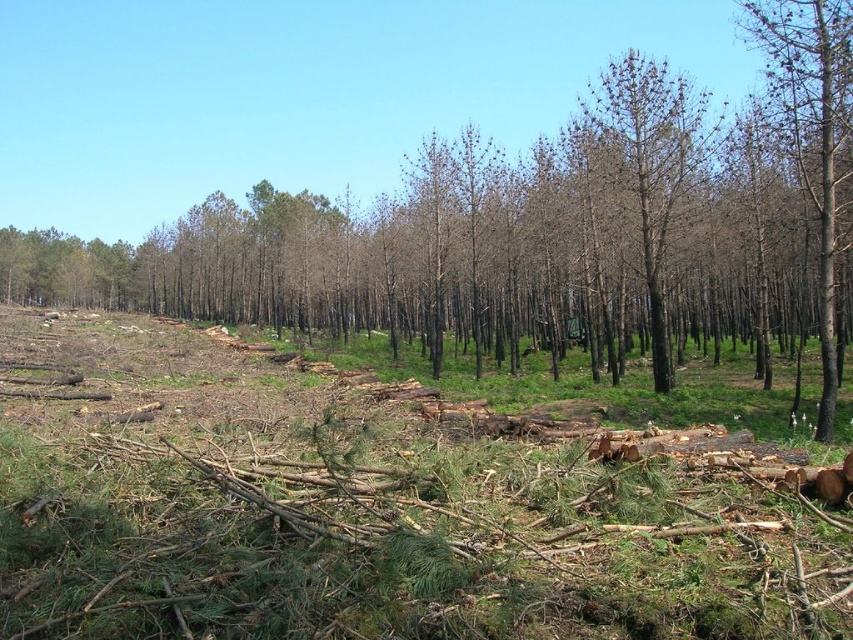
Describe the element at coordinates (543, 228) in the screenshot. The image size is (853, 640). I see `brown wood tree at center` at that location.

Who is positioned more to the right, brown wood tree at center or brown bark tree at right?

brown bark tree at right

Which is behind, point (672, 195) or point (821, 108)?

The point (672, 195) is more distant.

Image resolution: width=853 pixels, height=640 pixels. What are the coordinates of `brown wood tree at center` in the screenshot? It's located at (543, 228).

Does brown bark tree at right have a larger size compared to brown bark tree at center?

Yes, brown bark tree at right is bigger than brown bark tree at center.

I want to click on brown bark tree at right, so click(x=815, y=138).

Where is `brown bark tree at right`? brown bark tree at right is located at coordinates (815, 138).

Is brown wood tree at center taller than brown bark tree at center?

Indeed, brown wood tree at center has a greater height compared to brown bark tree at center.

Which is behind, point (773, 323) or point (598, 109)?

Point (773, 323)

Where is `brown wood tree at center`? brown wood tree at center is located at coordinates (543, 228).